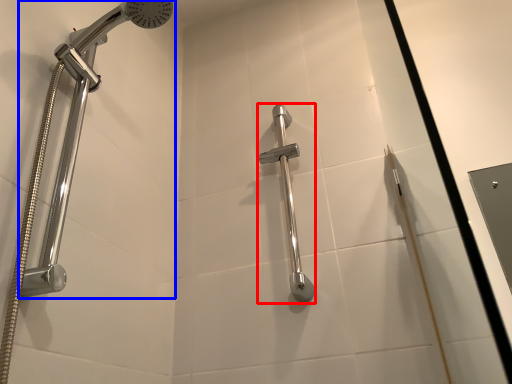
Question: Among these objects, which one is farthest to the camera, shower (highlighted by a red box) or shower (highlighted by a blue box)?

Choices:
 (A) shower
 (B) shower

Answer: (A)